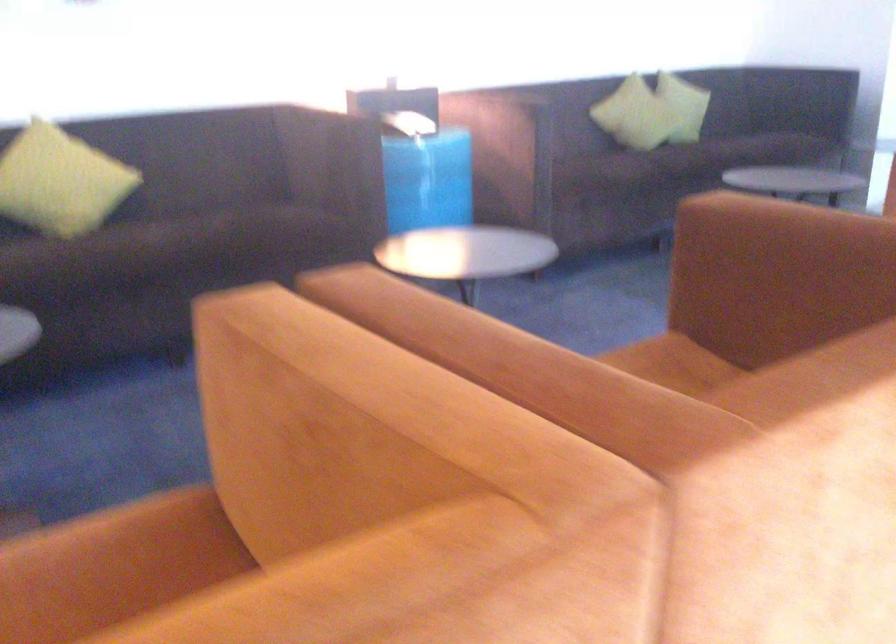
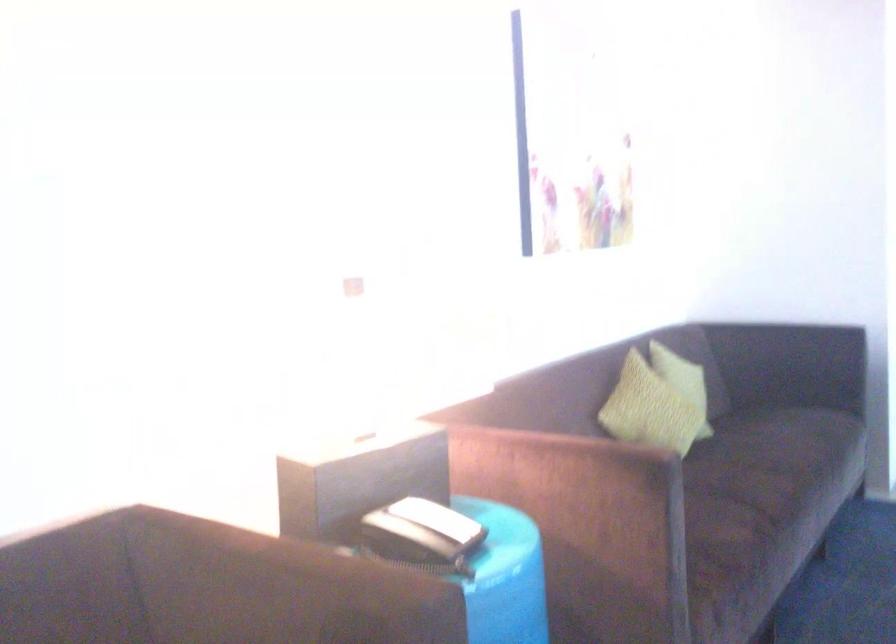
The point at (x=686, y=86) is marked in the first image. Where is the corresponding point in the second image?

(683, 381)